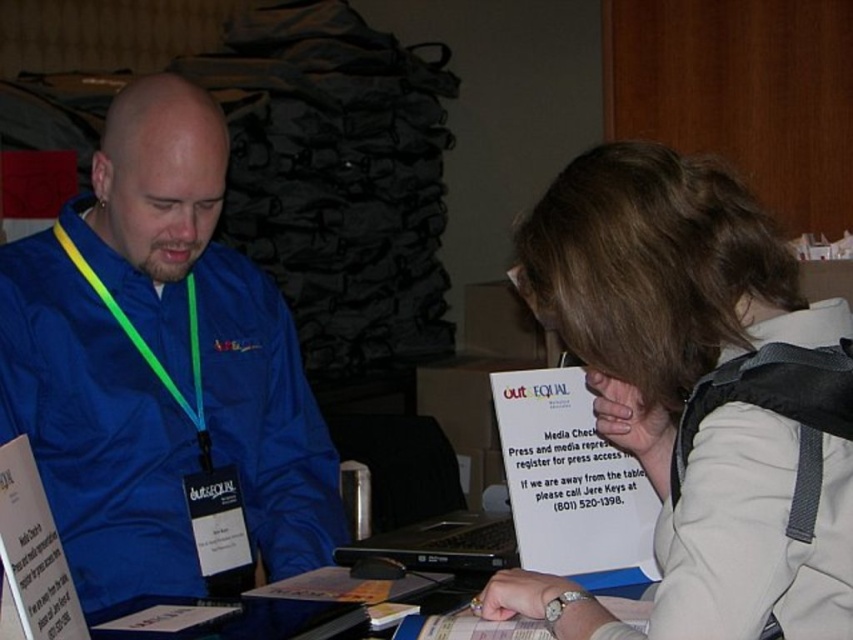
Does black plastic laptop at center have a greater width compared to green/yellow fabric lanyard at left?

Correct, the width of black plastic laptop at center exceeds that of green/yellow fabric lanyard at left.

Does point (422, 566) come behind point (109, 296)?

No, (422, 566) is closer to viewer.

I want to click on black plastic laptop at center, so click(440, 545).

Can you confirm if blue fabric jacket at left is bigger than light beige fabric jacket at lower right?

Yes, blue fabric jacket at left is bigger than light beige fabric jacket at lower right.

Is blue fabric jacket at left positioned at the back of light beige fabric jacket at lower right?

Yes, blue fabric jacket at left is behind light beige fabric jacket at lower right.

The height and width of the screenshot is (640, 853). What do you see at coordinates (160, 364) in the screenshot?
I see `blue fabric jacket at left` at bounding box center [160, 364].

You are a GUI agent. You are given a task and a screenshot of the screen. Output one action in this format:
    pyautogui.click(x=<x>, y=<y>)
    Task: Click on the blue fabric jacket at left
    The height and width of the screenshot is (640, 853).
    Given the screenshot: What is the action you would take?
    point(160,364)

Consider the image. Does blue fabric jacket at left have a lesser height compared to black plastic laptop at center?

In fact, blue fabric jacket at left may be taller than black plastic laptop at center.

This screenshot has width=853, height=640. What do you see at coordinates (160, 364) in the screenshot?
I see `blue fabric jacket at left` at bounding box center [160, 364].

Find the location of a particular element. The width and height of the screenshot is (853, 640). blue fabric jacket at left is located at coordinates (160, 364).